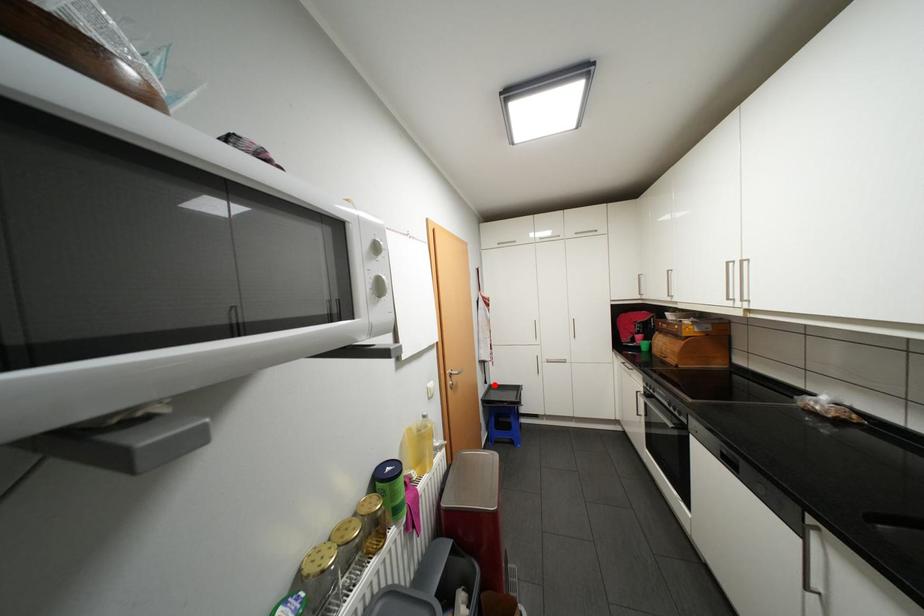
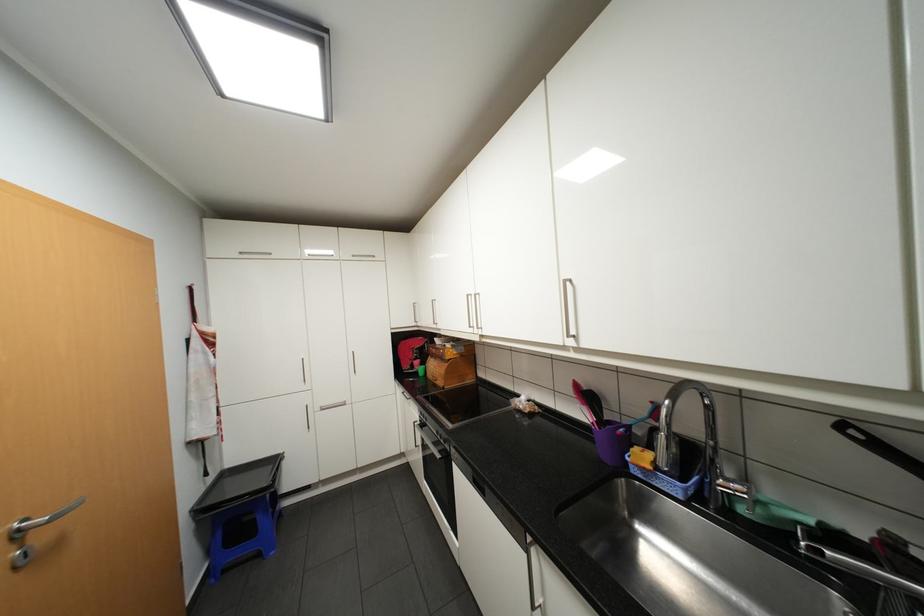
Question: A red point is marked in image1. In image2, is the corresponding 3D point closer to the camera or farther? Reply with the corresponding letter.

Choices:
 (A) The corresponding 3D point is closer.
 (B) The corresponding 3D point is farther.

Answer: (A)